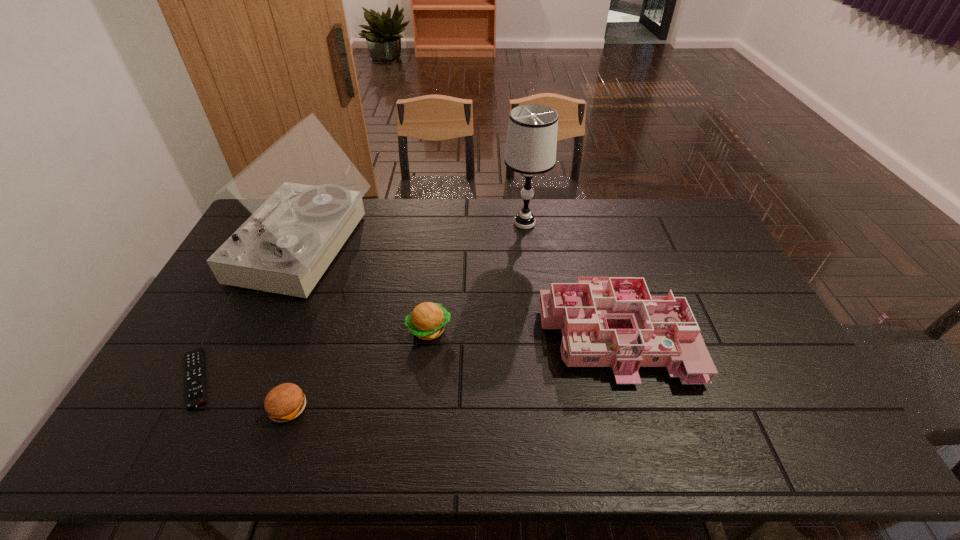
Identify the location of free region at the far edge of the desktop. click(568, 203).

In order to click on vacant space at the near edge in this screenshot , I will do click(x=389, y=431).

Identify the location of vacant space at the left edge. (261, 296).

At what (x,y) coordinates should I click in order to perform the action: click on vacant space at the right edge. Please return your answer as a coordinate pair (x, y). The width and height of the screenshot is (960, 540). Looking at the image, I should click on (740, 307).

Identify the location of free region at the near right corner of the desktop. This screenshot has height=540, width=960. (789, 449).

Locate an element on the screen. The height and width of the screenshot is (540, 960). vacant area that lies between the dollhouse and the shorter hamburger is located at coordinates (450, 369).

The image size is (960, 540). Identify the location of free space between the shortest object and the record player. (251, 314).

Identify the location of empty space that is in between the shortest object and the dollhouse. The image size is (960, 540). (404, 355).

Image resolution: width=960 pixels, height=540 pixels. I want to click on vacant point located between the right hamburger and the record player, so click(367, 289).

At what (x,y) coordinates should I click in order to perform the action: click on vacant area between the remote control and the table lamp. Please return your answer as a coordinate pair (x, y). This screenshot has width=960, height=540. Looking at the image, I should click on (360, 301).